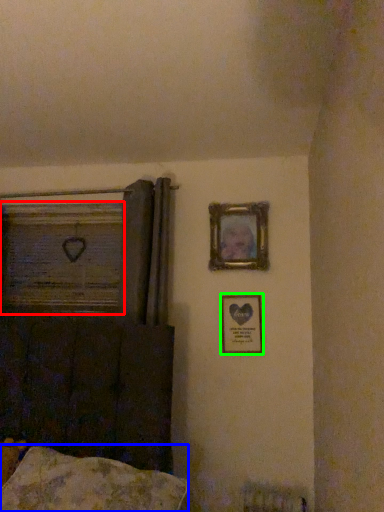
Question: Based on their relative distances, which object is farther from window frame (highlighted by a red box)? Choose from pillow (highlighted by a blue box) and picture frame (highlighted by a green box).

Choices:
 (A) pillow
 (B) picture frame

Answer: (A)